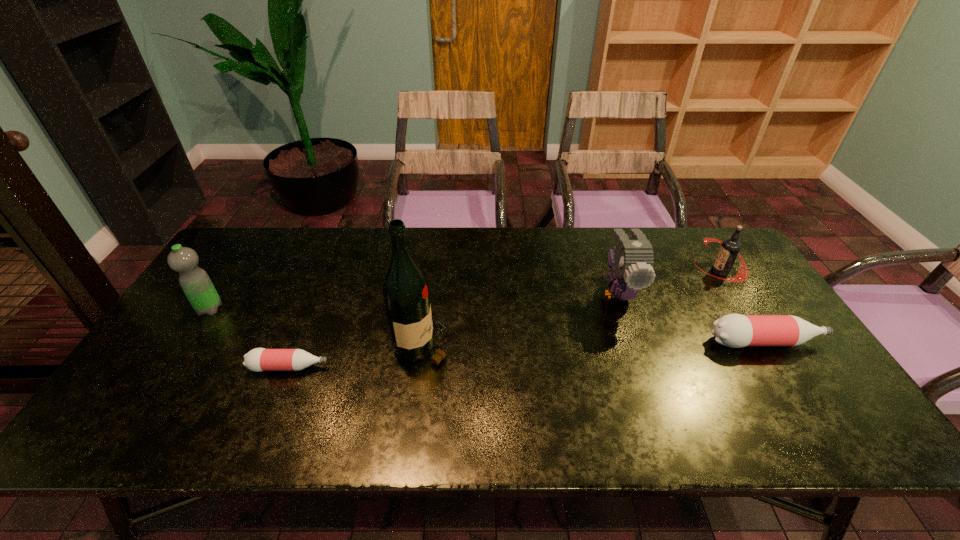
At what (x,y) coordinates should I click in order to perform the action: click on the nearer bottle. Please return your answer as a coordinate pair (x, y). Looking at the image, I should click on (259, 359).

Where is `the fifth object from right to left`? The width and height of the screenshot is (960, 540). the fifth object from right to left is located at coordinates tap(259, 359).

Where is `the taller bottle`? The width and height of the screenshot is (960, 540). the taller bottle is located at coordinates (733, 330).

Locate an element on the screen. The width and height of the screenshot is (960, 540). the fifth tallest object is located at coordinates (733, 330).

Where is `bird`? This screenshot has width=960, height=540. bird is located at coordinates (632, 260).

Locate an element on the screen. root beer is located at coordinates (730, 247).

Find the location of a particular element. The width and height of the screenshot is (960, 540). the leftmost object is located at coordinates (196, 284).

Image resolution: width=960 pixels, height=540 pixels. I want to click on wine bottle, so click(x=406, y=297).

Where is `the tallest object`? the tallest object is located at coordinates (406, 297).

Where is `free region located with the cap open on the shortest object`? free region located with the cap open on the shortest object is located at coordinates tap(489, 367).